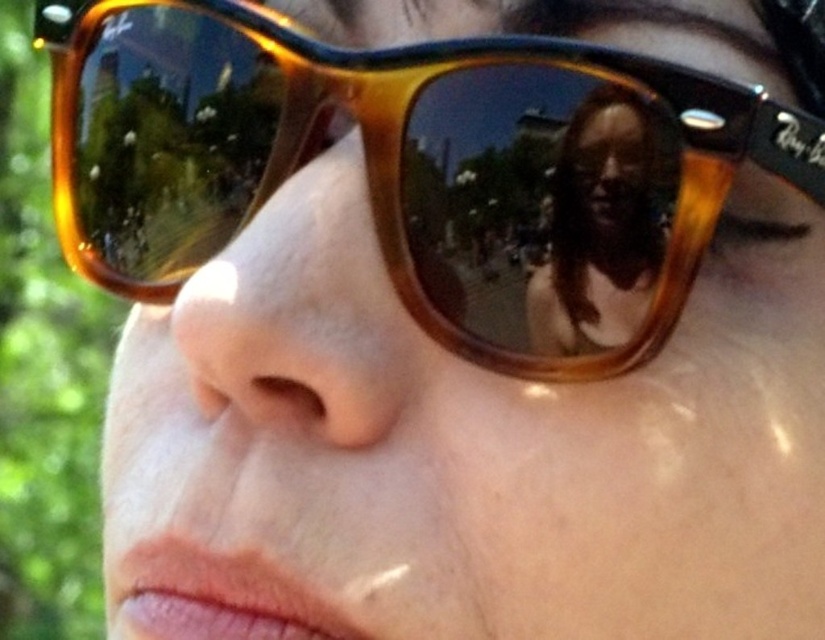
You are a photographer adjusting the focus on your camera. You need to capture both the tortoiseshell sunglasses at center and the matte brown hair at center in sharp detail. Given that your camera has a depth of field that can sharply focus on objects within 4 inches of each other, will both subjects be in focus?

The tortoiseshell sunglasses at center is 4.28 inches from matte brown hair at center. Since the distance between them exceeds the camera s 4 inch depth of field range, only one of the subjects will be in sharp focus, not both.